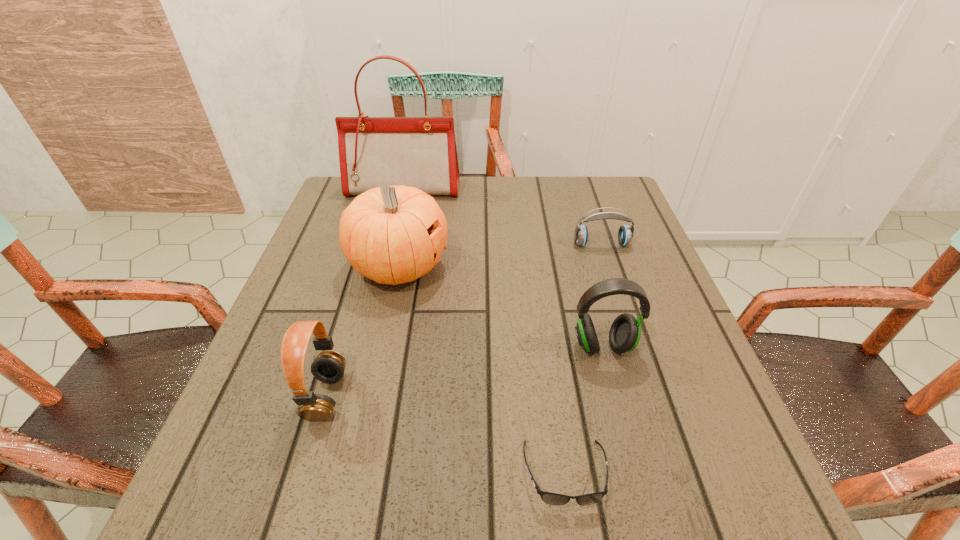
Where is `object located at the far left corner`? object located at the far left corner is located at coordinates (420, 152).

Image resolution: width=960 pixels, height=540 pixels. I want to click on vacant area at the far edge, so click(x=473, y=189).

At what (x,y) coordinates should I click in order to perform the action: click on vacant space at the near edge of the desktop. Please return your answer as a coordinate pair (x, y). Looking at the image, I should click on (496, 516).

I want to click on vacant space at the left edge of the desktop, so click(347, 267).

The image size is (960, 540). In the image, there is a desktop. Identify the location of free space at the right edge. (660, 417).

Image resolution: width=960 pixels, height=540 pixels. I want to click on free point at the far left corner, so click(351, 201).

The image size is (960, 540). Find the location of `vacant space at the far right corner of the desktop`. vacant space at the far right corner of the desktop is located at coordinates (587, 186).

Locate an element on the screen. free space at the near right corner of the desktop is located at coordinates (666, 507).

Locate an element on the screen. This screenshot has height=540, width=960. free space that is in between the farthest headset and the farthest object is located at coordinates (502, 217).

This screenshot has width=960, height=540. I want to click on empty space between the nearest object and the shortest headset, so click(x=583, y=359).